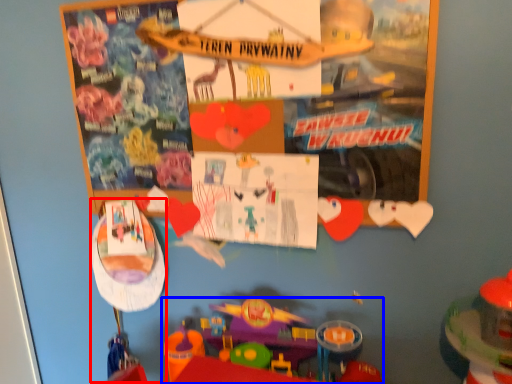
Question: Among these objects, which one is nearest to the camera, toy (highlighted by a red box) or toy (highlighted by a blue box)?

Choices:
 (A) toy
 (B) toy

Answer: (B)